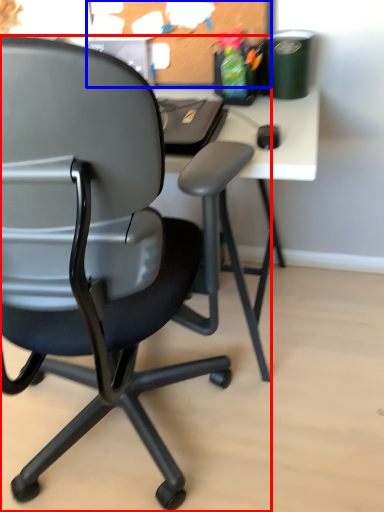
Question: Among these objects, which one is farthest to the camera, chair (highlighted by a red box) or bulletin board (highlighted by a blue box)?

Choices:
 (A) chair
 (B) bulletin board

Answer: (B)